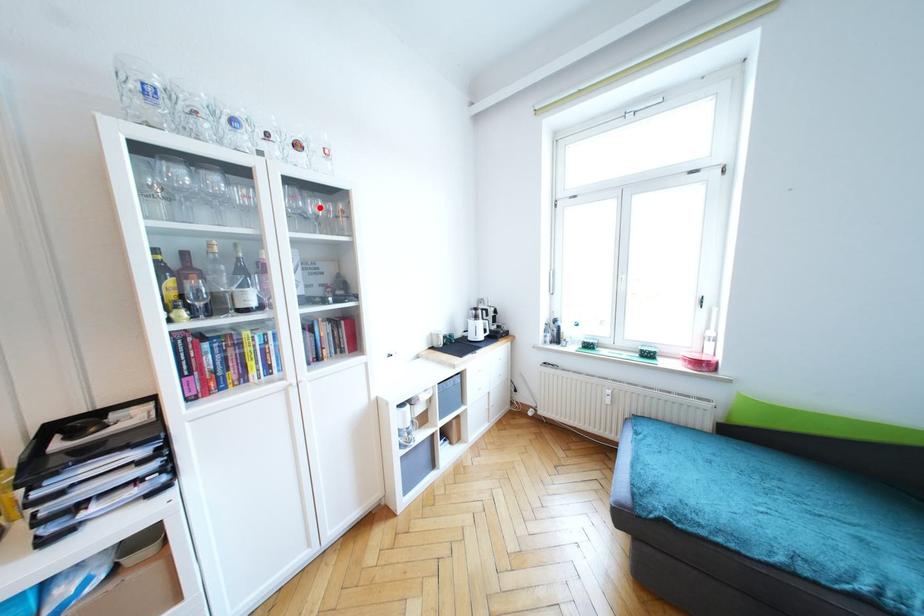
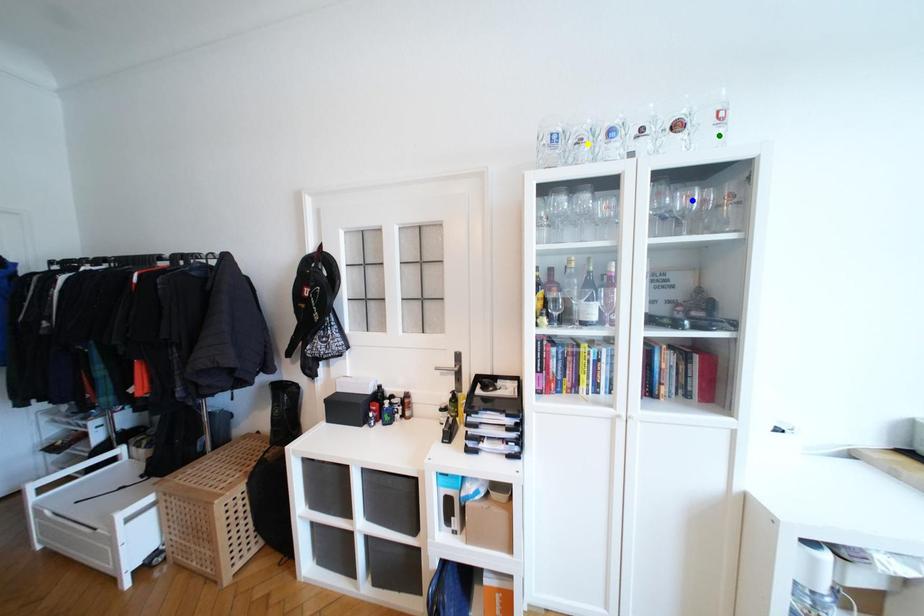
Question: I am providing you with two images of the same scene from different viewpoints. A red point is marked on the first image. You are given multiple points on the second image. In image 2, which mark is for the same physical point as the one in image 1?

Choices:
 (A) green point
 (B) yellow point
 (C) blue point

Answer: (C)